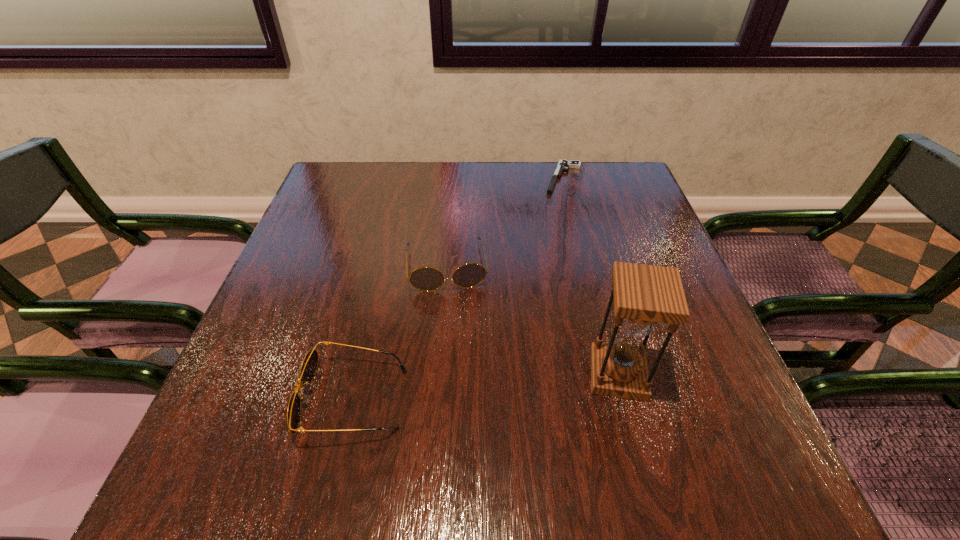
At what (x,y) coordinates should I click in order to perform the action: click on pistol positioned at the right edge. Please return your answer as a coordinate pair (x, y). This screenshot has height=540, width=960. Looking at the image, I should click on (563, 165).

Where is `object that is at the near left corner`? The height and width of the screenshot is (540, 960). object that is at the near left corner is located at coordinates (309, 365).

At what (x,y) coordinates should I click in order to perform the action: click on object present at the far right corner. Please return your answer as a coordinate pair (x, y). This screenshot has width=960, height=540. Looking at the image, I should click on (563, 165).

At what (x,y) coordinates should I click in order to perform the action: click on object positioned at the near right corner. Please return your answer as a coordinate pair (x, y). The image size is (960, 540). Looking at the image, I should click on (644, 295).

You are a GUI agent. You are given a task and a screenshot of the screen. Output one action in this format:
    pyautogui.click(x=<x>, y=<y>)
    Task: Click on the vacant space at the far edge of the desktop
    The width and height of the screenshot is (960, 540).
    Given the screenshot: What is the action you would take?
    pyautogui.click(x=551, y=200)

The image size is (960, 540). In the image, there is a desktop. What are the coordinates of `blank space at the near edge` in the screenshot? It's located at (519, 397).

In the image, there is a desktop. Find the location of `vacant space at the left edge`. vacant space at the left edge is located at coordinates (282, 342).

In the image, there is a desktop. Find the location of `blank space at the right edge`. blank space at the right edge is located at coordinates 673,345.

You are a GUI agent. You are given a task and a screenshot of the screen. Output one action in this format:
    pyautogui.click(x=<x>, y=<y>)
    Task: Click on the blank space at the far left corner
    The height and width of the screenshot is (540, 960).
    Given the screenshot: What is the action you would take?
    pyautogui.click(x=333, y=174)

The image size is (960, 540). What are the coordinates of `vacant space at the far right corner of the desktop` in the screenshot? It's located at (588, 188).